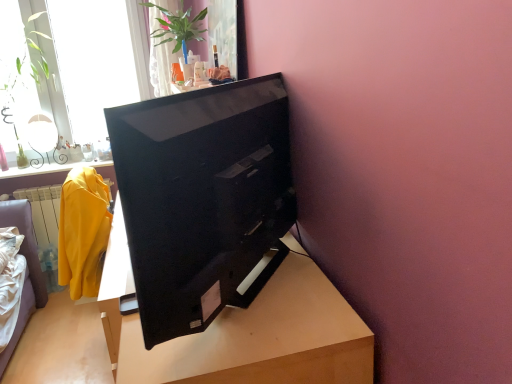
Question: Considering the positions of point (218, 228) and point (202, 18), is point (218, 228) closer or farther from the camera than point (202, 18)?

Choices:
 (A) closer
 (B) farther

Answer: (A)

Question: Relative to green glossy plant at upper center, is black glossy television at center in front or behind?

Choices:
 (A) behind
 (B) front

Answer: (B)

Question: Estimate the real-world distances between objects in this image. Which object is farther from the black glossy television at center?

Choices:
 (A) transparent glass window at upper left
 (B) green leafy plant at upper left
 (C) wooden table at center
 (D) green glossy plant at upper center

Answer: (B)

Question: Estimate the real-world distances between objects in this image. Which object is closer to the wooden table at center?

Choices:
 (A) transparent glass window at upper left
 (B) green glossy plant at upper center
 (C) black glossy television at center
 (D) green leafy plant at upper left

Answer: (C)